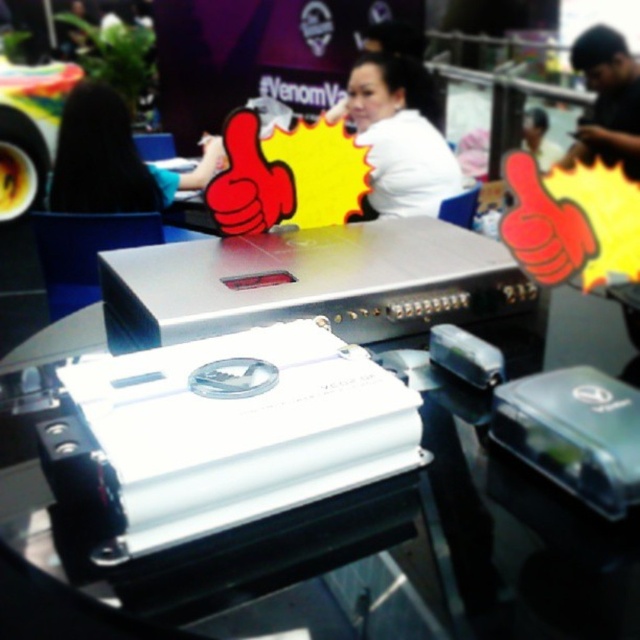
You are at an event and see a person wearing a white matte shirt at upper center and has blonde hair at upper left. Which part of their appearance is more to the left?

The blonde hair at upper left is more to the left than the white matte shirt at upper center.

You are an event organizer looking at the setup for an audio equipment exhibition. You notice two shirts displayed in the image. The white matte shirt at upper center and the black matte shirt at upper right. Which shirt is placed lower in the display?

The white matte shirt at upper center is positioned under the black matte shirt at upper right, so it is placed lower in the display.

You are attending an audio equipment exhibition and notice two people in the image. One is wearing a white matte shirt at upper center, and the other has blonde hair at upper left. Which person is standing closer to the front of the image?

The white matte shirt at upper center is much taller than the blonde hair at upper left, indicating it is closer to the front of the image.